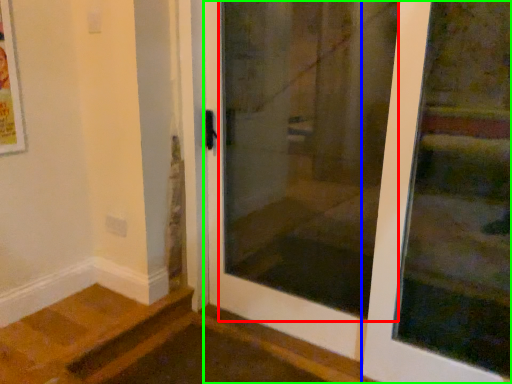
Question: Which is farther away from screen door (highlighted by a red box)? door (highlighted by a blue box) or door (highlighted by a green box)?

Choices:
 (A) door
 (B) door

Answer: (A)